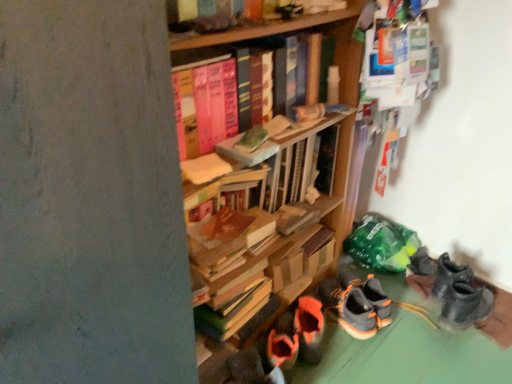
Describe the element at coordinates (356, 303) in the screenshot. I see `gray suede sneakers at lower center` at that location.

Find the location of a particular element. The height and width of the screenshot is (384, 512). gray suede sneakers at lower center is located at coordinates (356, 303).

Find the location of a particular element. The height and width of the screenshot is (384, 512). hardcover books at upper center is located at coordinates (216, 107).

What do you see at coordinates (216, 107) in the screenshot? This screenshot has width=512, height=384. I see `hardcover books at upper center` at bounding box center [216, 107].

Locate an element on the screen. gray suede sneakers at lower center is located at coordinates (356, 303).

Does gray suede sneakers at lower center appear on the left side of hardcover books at upper center?

Incorrect, gray suede sneakers at lower center is not on the left side of hardcover books at upper center.

Which object is closer to the camera taking this photo, gray suede sneakers at lower center or hardcover books at upper center?

hardcover books at upper center is closer to the camera.

Which is more distant, (x=378, y=291) or (x=201, y=110)?

Positioned behind is point (x=378, y=291).

From the image's perspective, is gray suede sneakers at lower center on top of hardcover books at upper center?

Actually, gray suede sneakers at lower center appears below hardcover books at upper center in the image.

From a real-world perspective, which is physically below, gray suede sneakers at lower center or hardcover books at upper center?

gray suede sneakers at lower center, from a real-world perspective.

Between gray suede sneakers at lower center and hardcover books at upper center, which one has smaller width?

Thinner between the two is hardcover books at upper center.

Considering the relative sizes of gray suede sneakers at lower center and hardcover books at upper center in the image provided, is gray suede sneakers at lower center shorter than hardcover books at upper center?

Yes, gray suede sneakers at lower center is shorter than hardcover books at upper center.

Considering the sizes of objects gray suede sneakers at lower center and hardcover books at upper center in the image provided, who is bigger, gray suede sneakers at lower center or hardcover books at upper center?

Bigger between the two is hardcover books at upper center.

Based on the photo, is gray suede sneakers at lower center situated inside hardcover books at upper center or outside?

gray suede sneakers at lower center lies outside hardcover books at upper center.

Is gray suede sneakers at lower center not close to hardcover books at upper center?

They are positioned close to each other.

Based on the photo, is gray suede sneakers at lower center facing away from hardcover books at upper center?

gray suede sneakers at lower center is not turned away from hardcover books at upper center.

This screenshot has height=384, width=512. Identify the location of footwear below the hardcover books at upper center (from the image's perspective). (356, 303).

Can you confirm if hardcover books at upper center is positioned to the left of gray suede sneakers at lower center?

Yes, hardcover books at upper center is to the left of gray suede sneakers at lower center.

Relative to gray suede sneakers at lower center, is hardcover books at upper center in front or behind?

hardcover books at upper center is in front of gray suede sneakers at lower center.

Between point (222, 129) and point (386, 314), which one is positioned behind?

Positioned behind is point (386, 314).

From the image's perspective, relative to gray suede sneakers at lower center, is hardcover books at upper center above or below?

Based on their image positions, hardcover books at upper center is located above gray suede sneakers at lower center.

From a real-world perspective, is hardcover books at upper center below gray suede sneakers at lower center?

No.

Considering the sizes of objects hardcover books at upper center and gray suede sneakers at lower center in the image provided, who is thinner, hardcover books at upper center or gray suede sneakers at lower center?

Thinner between the two is hardcover books at upper center.

Considering the relative sizes of hardcover books at upper center and gray suede sneakers at lower center in the image provided, is hardcover books at upper center taller than gray suede sneakers at lower center?

Yes.

Is hardcover books at upper center bigger or smaller than gray suede sneakers at lower center?

In the image, hardcover books at upper center appears to be larger than gray suede sneakers at lower center.

Is gray suede sneakers at lower center inside hardcover books at upper center?

No, gray suede sneakers at lower center is not surrounded by hardcover books at upper center.

Based on the photo, is hardcover books at upper center directly adjacent to gray suede sneakers at lower center?

hardcover books at upper center and gray suede sneakers at lower center are not in contact.

Is hardcover books at upper center looking in the opposite direction of gray suede sneakers at lower center?

No, hardcover books at upper center is not facing away from gray suede sneakers at lower center.

Can you tell me how much hardcover books at upper center and gray suede sneakers at lower center differ in facing direction?

The angle between the facing direction of hardcover books at upper center and the facing direction of gray suede sneakers at lower center is 157 degrees.

Looking at this image, how much distance is there between hardcover books at upper center and gray suede sneakers at lower center?

The distance of hardcover books at upper center from gray suede sneakers at lower center is 33.27 inches.

Locate an element on the screen. The width and height of the screenshot is (512, 384). footwear behind the hardcover books at upper center is located at coordinates (356, 303).

Image resolution: width=512 pixels, height=384 pixels. I want to click on footwear that appears below the hardcover books at upper center (from the image's perspective), so click(356, 303).

At what (x,y) coordinates should I click in order to perform the action: click on footwear that is on the right side of hardcover books at upper center. Please return your answer as a coordinate pair (x, y). Looking at the image, I should click on (356, 303).